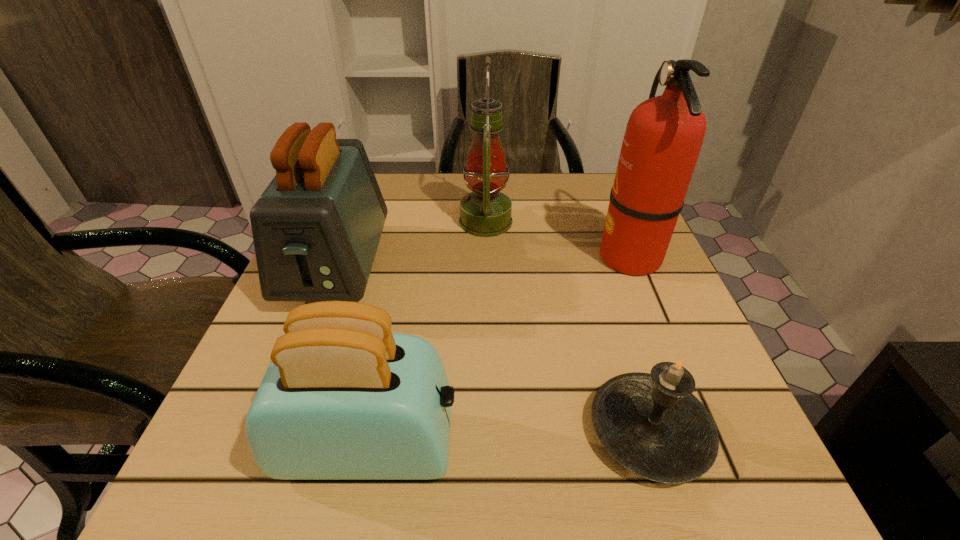
The image size is (960, 540). I want to click on fire extinguisher, so click(x=663, y=138).

The image size is (960, 540). Find the location of `oil lamp`. oil lamp is located at coordinates (486, 212).

Locate an element on the screen. The width and height of the screenshot is (960, 540). the farther toaster is located at coordinates (316, 228).

Locate an element on the screen. The image size is (960, 540). the nearer toaster is located at coordinates (343, 398).

Identify the location of the shortest object. The image size is (960, 540). (650, 423).

Where is `free space located 0.310m on the side of the fire extinguisher with the nozzle and handle`? Image resolution: width=960 pixels, height=540 pixels. free space located 0.310m on the side of the fire extinguisher with the nozzle and handle is located at coordinates (448, 256).

Image resolution: width=960 pixels, height=540 pixels. Find the location of `free region located 0.300m on the side of the fire extinguisher with the nozzle and handle`. free region located 0.300m on the side of the fire extinguisher with the nozzle and handle is located at coordinates (453, 256).

Locate an element on the screen. This screenshot has height=540, width=960. free space located on the side of the fire extinguisher with the nozzle and handle is located at coordinates (472, 256).

This screenshot has height=540, width=960. Find the location of `free spot located 0.180m on the front of the oil lamp`. free spot located 0.180m on the front of the oil lamp is located at coordinates (487, 301).

Locate an element on the screen. This screenshot has width=960, height=540. vacant space located on the front-facing side of the farther toaster is located at coordinates (289, 392).